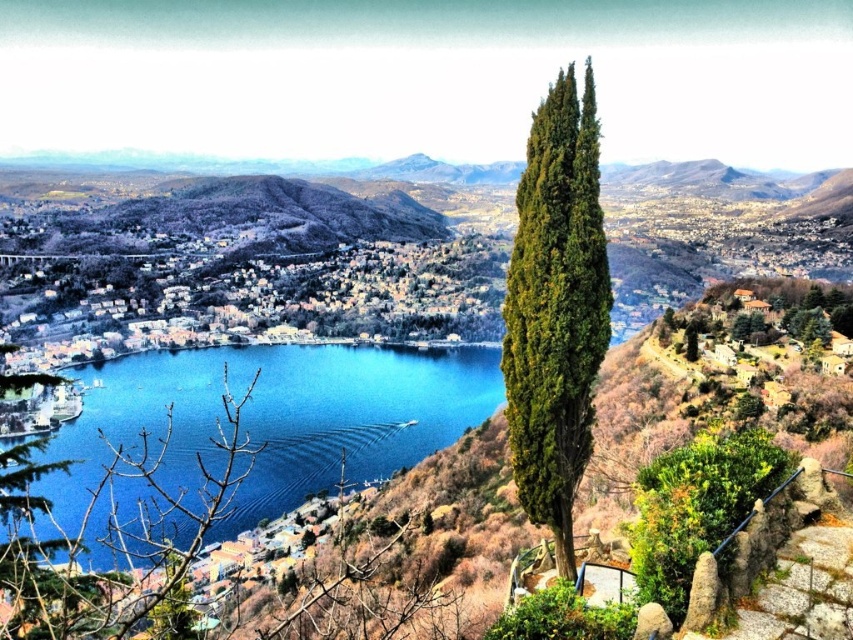
Question: Which object appears closest to the camera in this image?

Choices:
 (A) blue water at center
 (B) green matte tree at lower left
 (C) green textured cypress at right

Answer: (B)

Question: Does blue water at center appear over green textured cypress at right?

Choices:
 (A) yes
 (B) no

Answer: (B)

Question: Can you confirm if green textured cypress at right is positioned to the right of green matte tree at lower left?

Choices:
 (A) yes
 (B) no

Answer: (A)

Question: Among these objects, which one is farthest from the camera?

Choices:
 (A) green textured cypress at right
 (B) blue water at center

Answer: (B)

Question: Which point is farther from the camera taking this photo?

Choices:
 (A) (138, 477)
 (B) (532, 131)

Answer: (A)

Question: Where is blue water at center located in relation to green matte tree at lower left in the image?

Choices:
 (A) below
 (B) above

Answer: (B)